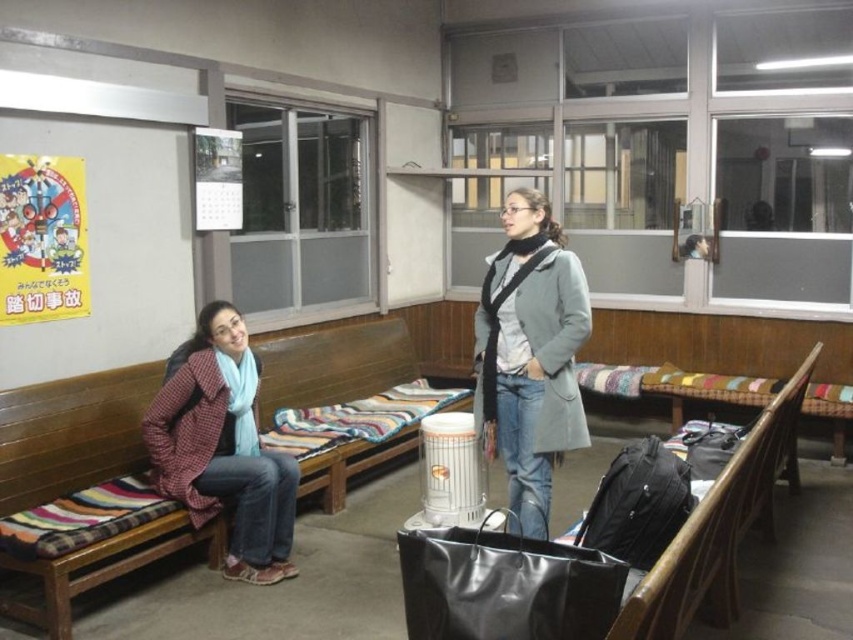
Is point (90, 412) farther from camera compared to point (543, 538)?

Yes, point (90, 412) is behind point (543, 538).

Image resolution: width=853 pixels, height=640 pixels. What do you see at coordinates (86, 502) in the screenshot? I see `wooden bench with striped cushion at left` at bounding box center [86, 502].

Does point (42, 406) come farther from viewer compared to point (537, 237)?

Yes, it is.

I want to click on wooden bench with striped cushion at left, so click(86, 502).

Is point (524, 246) positioned before point (248, 451)?

Yes, it is in front of point (248, 451).

From the picture: Can you confirm if gray wool coat at center is positioned below plaid woolen jacket at left?

Incorrect, gray wool coat at center is not positioned below plaid woolen jacket at left.

Where is `gray wool coat at center`? The height and width of the screenshot is (640, 853). gray wool coat at center is located at coordinates (531, 355).

Is point (328, 502) positioned before point (231, 426)?

No, it is behind (231, 426).

Does wooden bench with striped cushion at left appear on the right side of plaid woolen jacket at left?

Indeed, wooden bench with striped cushion at left is positioned on the right side of plaid woolen jacket at left.

Which is behind, point (305, 509) or point (224, 404)?

Point (305, 509)

This screenshot has width=853, height=640. Find the location of `wooden bench with striped cushion at left`. wooden bench with striped cushion at left is located at coordinates (86, 502).